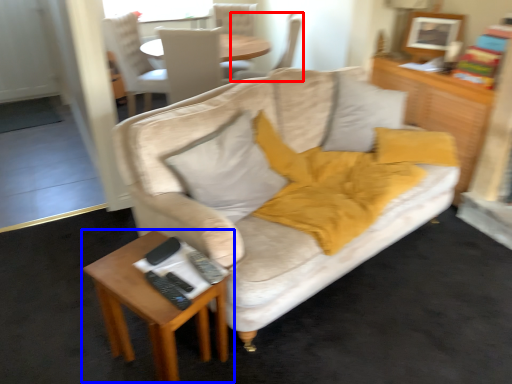
Question: Which of the following is the farthest to the observer, chair (highlighted by a red box) or table (highlighted by a blue box)?

Choices:
 (A) chair
 (B) table

Answer: (A)